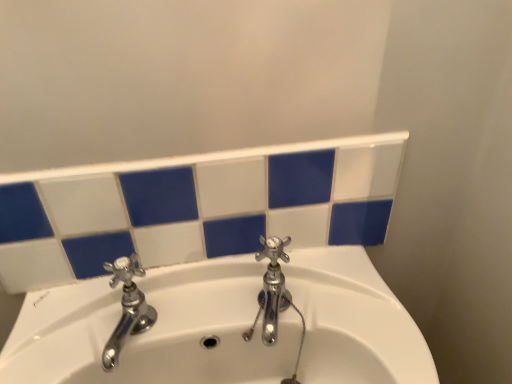
Question: Considering the positions of polished chrome faucet at left, which is the 2th tap from right to left, and chrome metallic faucet at center, the second tap viewed from the left, in the image, is polished chrome faucet at left, which is the 2th tap from right to left, bigger or smaller than chrome metallic faucet at center, the second tap viewed from the left,?

Choices:
 (A) small
 (B) big

Answer: (A)

Question: Is polished chrome faucet at left, which is the 1th tap in left-to-right order, wider or thinner than chrome metallic faucet at center, which is counted as the 1th tap, starting from the right?

Choices:
 (A) wide
 (B) thin

Answer: (B)

Question: From a real-world perspective, is polished chrome faucet at left, which is the 1th tap in left-to-right order, above or below chrome metallic faucet at center, which is counted as the 1th tap, starting from the right?

Choices:
 (A) below
 (B) above

Answer: (B)

Question: From a real-world perspective, is chrome metallic faucet at center, which is counted as the 1th tap, starting from the right, above or below polished chrome faucet at left, which is the 1th tap in left-to-right order?

Choices:
 (A) below
 (B) above

Answer: (A)

Question: Does point (284, 238) appear closer or farther from the camera than point (137, 296)?

Choices:
 (A) farther
 (B) closer

Answer: (A)

Question: Considering the positions of chrome metallic faucet at center, which is counted as the 1th tap, starting from the right, and polished chrome faucet at left, which is the 2th tap from right to left, in the image, is chrome metallic faucet at center, which is counted as the 1th tap, starting from the right, bigger or smaller than polished chrome faucet at left, which is the 2th tap from right to left,?

Choices:
 (A) small
 (B) big

Answer: (B)

Question: In the image, is chrome metallic faucet at center, the second tap viewed from the left, on the left side or the right side of polished chrome faucet at left, which is the 2th tap from right to left?

Choices:
 (A) left
 (B) right

Answer: (B)